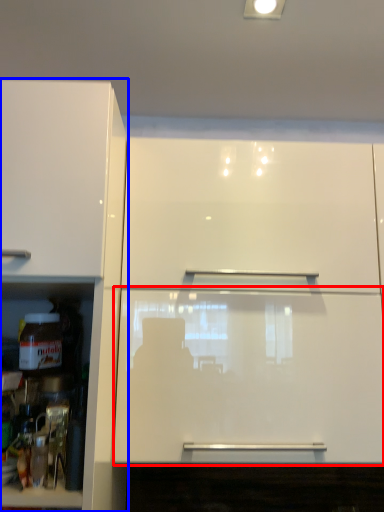
Question: Among these objects, which one is nearest to the camera, glass door (highlighted by a red box) or cabinetry (highlighted by a blue box)?

Choices:
 (A) glass door
 (B) cabinetry

Answer: (B)